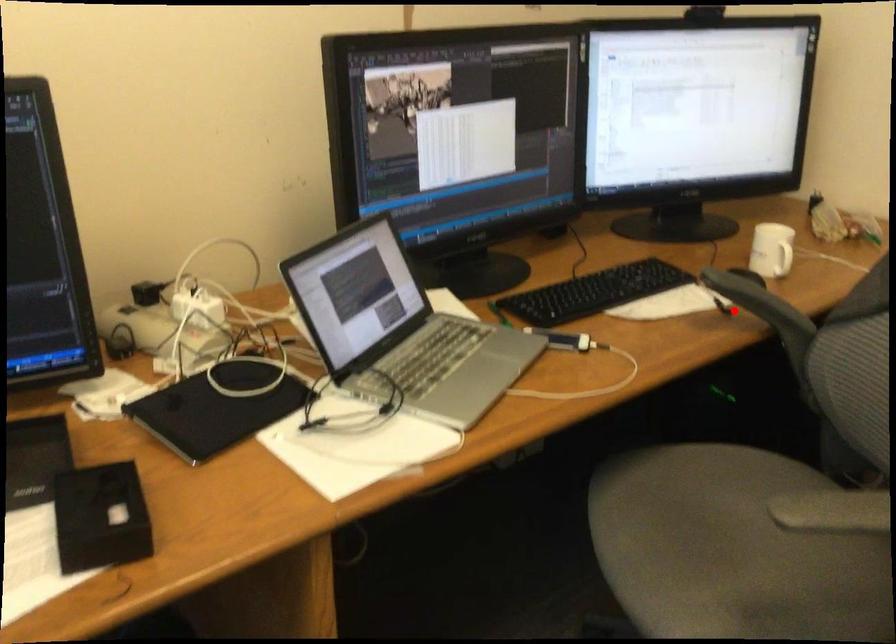
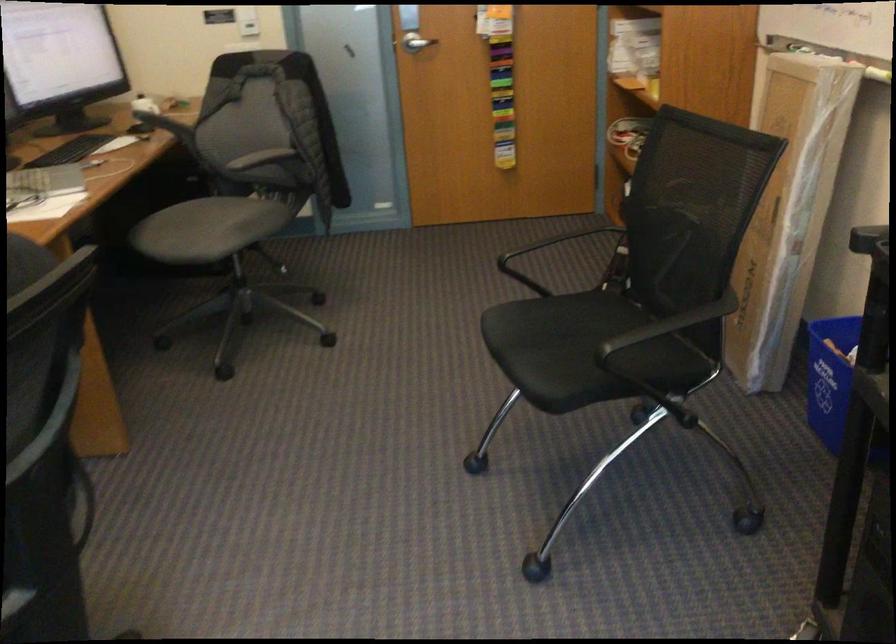
In the second image, find the point that corresponds to the highlighted location in the first image.

(158, 120)